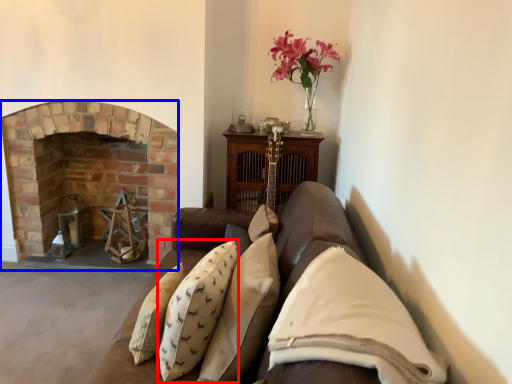
Question: Which of the following is the farthest to the observer, pillow (highlighted by a red box) or fireplace (highlighted by a blue box)?

Choices:
 (A) pillow
 (B) fireplace

Answer: (B)